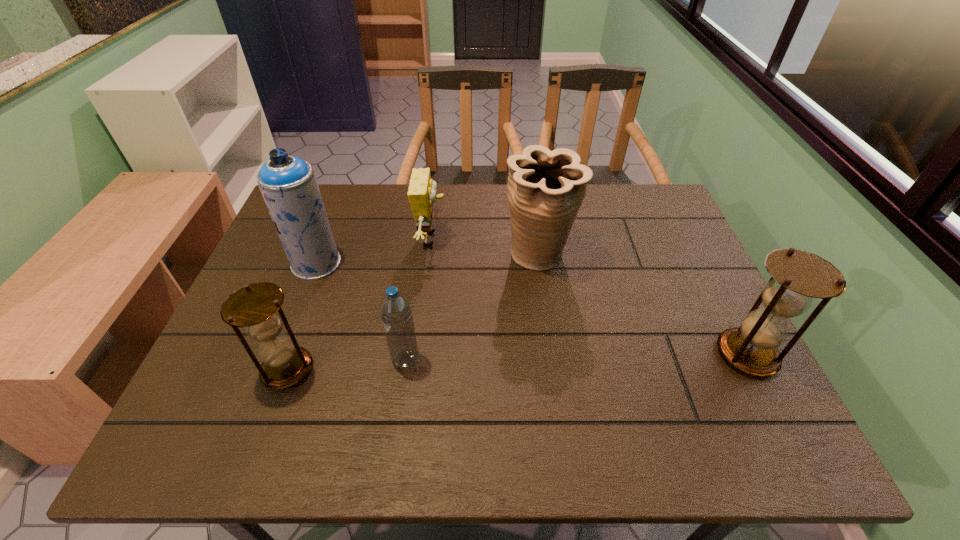
Locate an element on the screen. free spot between the rightmost object and the water bottle is located at coordinates (576, 357).

Locate an element on the screen. This screenshot has height=540, width=960. empty space between the rightmost object and the water bottle is located at coordinates (576, 357).

Where is `empty location between the second object from right to left and the water bottle`? empty location between the second object from right to left and the water bottle is located at coordinates (472, 307).

Find the location of a particular element. The width and height of the screenshot is (960, 540). unoccupied position between the water bottle and the sponge is located at coordinates (419, 299).

Find the location of a particular element. This screenshot has width=960, height=540. vacant space that's between the water bottle and the urn is located at coordinates click(x=472, y=307).

Select which object is the fourth closest to the shorter hourglass. Please provide its 2D coordinates. Your answer should be formatted as a tuple, i.e. [(x, y)], where the tuple contains the x and y coordinates of a point satisfying the conditions above.

[(546, 189)]

Locate which object is the second closest to the left hourglass. Please provide its 2D coordinates. Your answer should be formatted as a tuple, i.e. [(x, y)], where the tuple contains the x and y coordinates of a point satisfying the conditions above.

[(288, 184)]

The height and width of the screenshot is (540, 960). What are the coordinates of `free space that satisfies the following two spatial constraints: 1. on the face of the sponge; 2. on the front side of the left hourglass` in the screenshot? It's located at (417, 369).

Identify the location of blank space that satisfies the following two spatial constraints: 1. on the front side of the right hourglass; 2. on the right side of the urn. The image size is (960, 540). (552, 354).

I want to click on free spot that satisfies the following two spatial constraints: 1. on the front side of the urn; 2. on the right side of the rightmost object, so pyautogui.click(x=552, y=354).